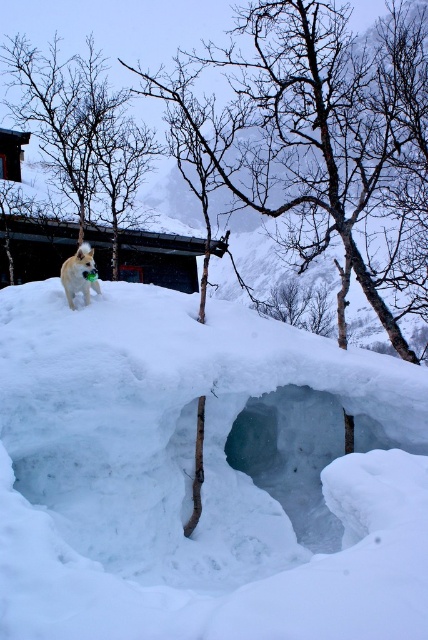
You are a photographer trying to capture the white fluffy snow at upper center and the fluffy white dog at upper left in the same frame. Considering their sizes, which one should you zoom in on to ensure both are visible without cropping?

The white fluffy snow at upper center is smaller than the fluffy white dog at upper left. To include both in the frame without cropping, you should zoom out slightly to accommodate the larger size of the fluffy white dog at upper left while still keeping the smaller white fluffy snow at upper center in view.

From the picture: You are standing in front of the snow structure and want to place a 3.0 meter long ladder against the white fluffy snow at upper center. Can the ladder reach the snow?

The white fluffy snow at upper center is 2.82 meters from the viewer. Since the ladder is 3.0 meters long, it can reach the snow as the ladder is longer than the distance required.

Consider the image. You are a photographer trying to capture the brown bark tree at upper left and the fluffy white dog at upper left in the same frame. Based on their sizes, which one will appear larger in the photo?

The brown bark tree at upper left will appear larger in the photo because its width surpasses that of the fluffy white dog at upper left.